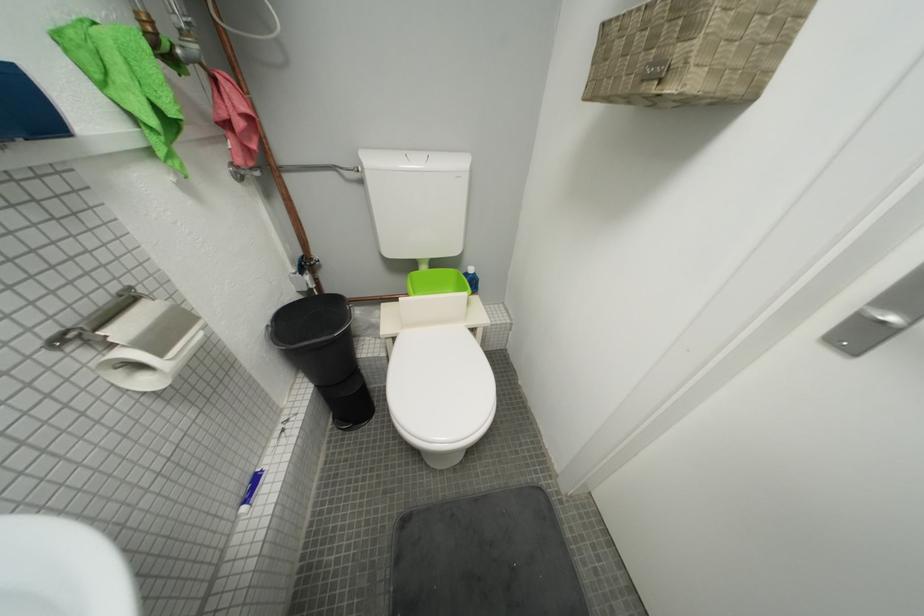
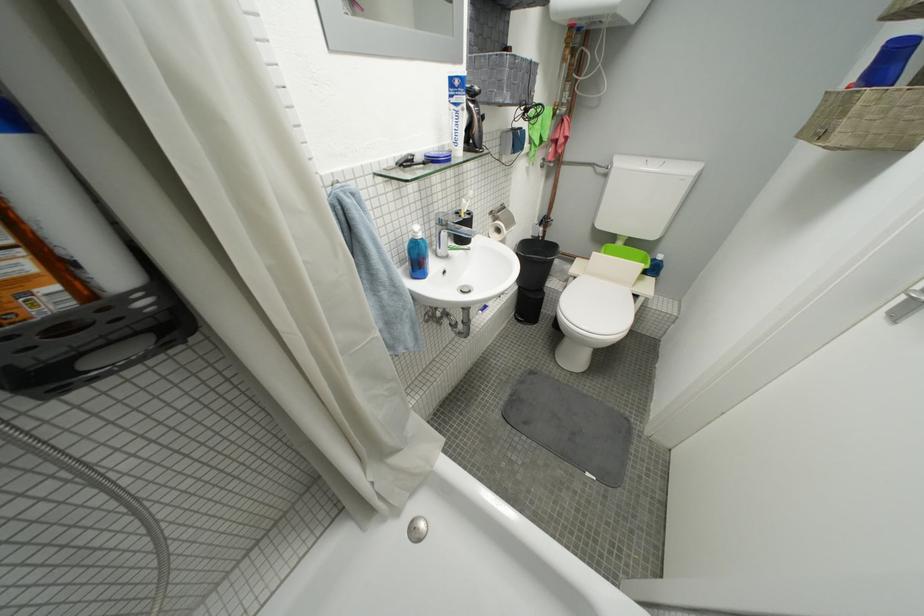
In the second image, find the point that corresponds to (403,341) in the first image.

(584, 281)